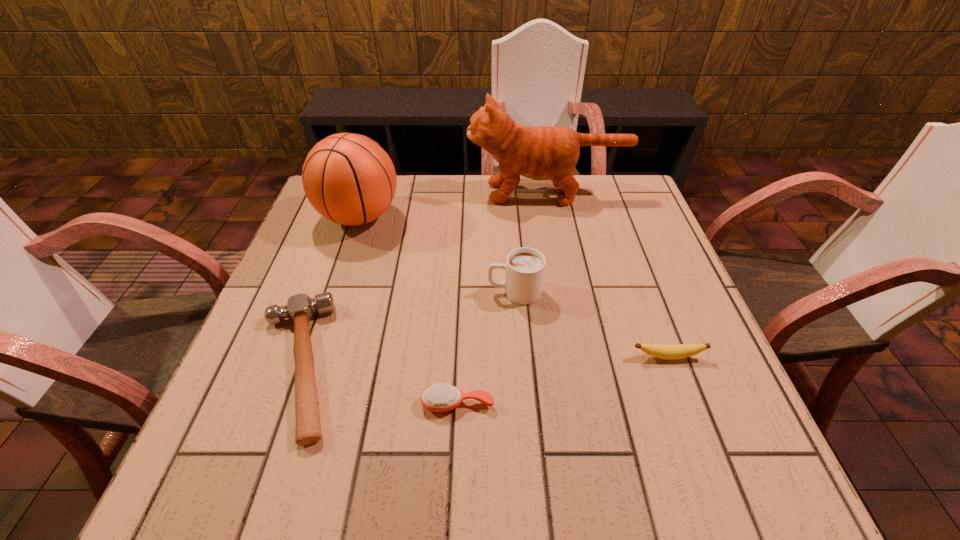
This screenshot has height=540, width=960. Identify the location of the tallest object. (540, 153).

Where is `basketball`? basketball is located at coordinates (348, 178).

Identify the location of cappuccino. (525, 267).

You are a GUI agent. You are given a task and a screenshot of the screen. Output one action in this format:
    pyautogui.click(x=<x>, y=<y>)
    Task: Click on the hammer
    Image resolution: width=960 pixels, height=540 pixels.
    Given the screenshot: What is the action you would take?
    pyautogui.click(x=300, y=308)

The width and height of the screenshot is (960, 540). I want to click on banana, so click(x=670, y=352).

You are a GUI agent. You are given a task and a screenshot of the screen. Output one action in this format:
    pyautogui.click(x=<x>, y=<y>)
    Task: Click on the hairbrush
    The width and height of the screenshot is (960, 540).
    Given the screenshot: What is the action you would take?
    pyautogui.click(x=438, y=398)

I want to click on vacant space located 0.150m on the face of the cat, so click(417, 193).

The height and width of the screenshot is (540, 960). Identify the location of vacant region located on the face of the cat. (430, 193).

The height and width of the screenshot is (540, 960). What are the coordinates of `free region located 0.060m on the face of the cat` in the screenshot? It's located at (447, 193).

The image size is (960, 540). Find the location of `vacant area located on the right of the basketball`. vacant area located on the right of the basketball is located at coordinates (523, 217).